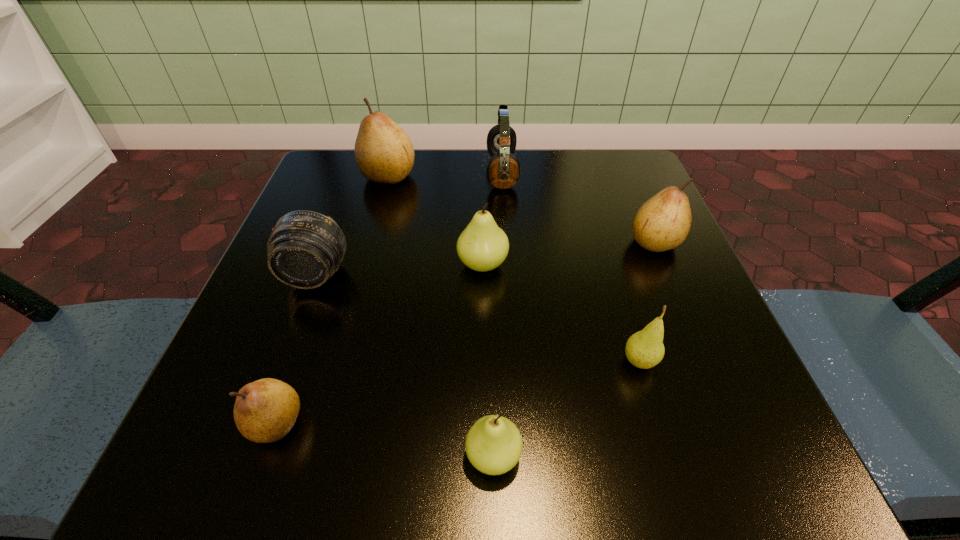
In the image, there is a desktop. Identify the location of vacant area at the far left corner. The height and width of the screenshot is (540, 960). (383, 187).

Locate an element on the screen. The image size is (960, 540). vacant area at the near left corner is located at coordinates (300, 436).

In the image, there is a desktop. Where is `vacant area at the far right corner`? vacant area at the far right corner is located at coordinates (597, 195).

This screenshot has width=960, height=540. In order to click on free space at the near right corner of the desktop in this screenshot , I will do `click(745, 437)`.

Locate an element on the screen. The width and height of the screenshot is (960, 540). free spot between the nearer green pear and the second object from right to left is located at coordinates (566, 409).

This screenshot has width=960, height=540. In order to click on free space between the farther green pear and the rightmost object in this screenshot , I will do `click(568, 253)`.

At what (x,y) coordinates should I click in order to perform the action: click on empty location between the headset and the telephoto lens. Please return your answer as a coordinate pair (x, y). Image resolution: width=960 pixels, height=540 pixels. Looking at the image, I should click on (409, 224).

Identify the location of vacant area between the nearer green pear and the telephoto lens. (404, 366).

Identify the location of vacant region between the farthest brown pear and the bigger green pear. (436, 220).

Where is `vacant area that lies between the farthest pear and the nearer green pear`? This screenshot has height=540, width=960. vacant area that lies between the farthest pear and the nearer green pear is located at coordinates (441, 316).